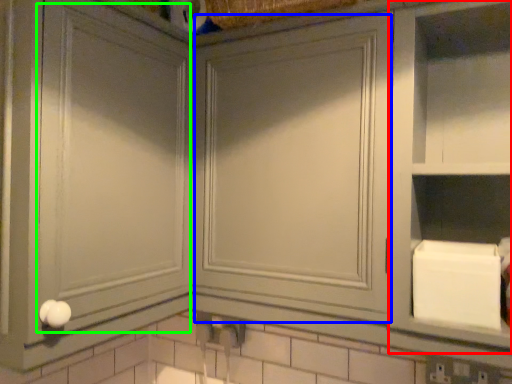
Question: Which is nearer to the cabinet (highlighted by a red box)? glass door (highlighted by a blue box) or glass door (highlighted by a green box).

Choices:
 (A) glass door
 (B) glass door

Answer: (A)